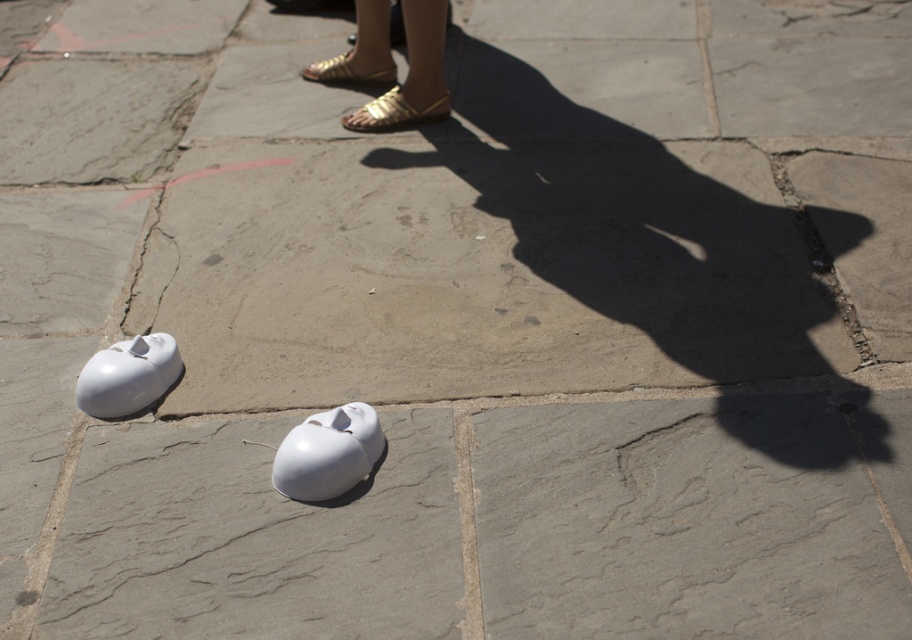
Question: Is gold metallic sandals at upper center wider than white glossy mouse at center?

Choices:
 (A) no
 (B) yes

Answer: (B)

Question: Which of these objects is positioned closest to the white matte mouse at lower left?

Choices:
 (A) gold metallic sandals at upper center
 (B) white glossy mouse at center

Answer: (B)

Question: Which point is farther to the camera?

Choices:
 (A) gold metallic sandals at upper center
 (B) white matte mouse at lower left
 (C) white glossy mouse at center

Answer: (A)

Question: Is gold metallic sandals at upper center above white glossy mouse at center?

Choices:
 (A) no
 (B) yes

Answer: (B)

Question: Is gold metallic sandals at upper center positioned before white matte mouse at lower left?

Choices:
 (A) yes
 (B) no

Answer: (B)

Question: Which of the following is the farthest from the observer?

Choices:
 (A) (360, 129)
 (B) (334, 419)
 (C) (162, 332)

Answer: (A)